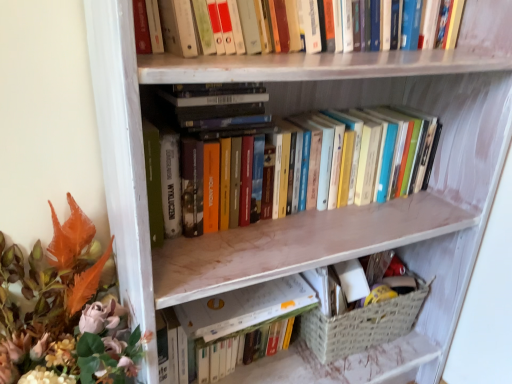
Question: Considering the relative sizes of hardcover books at upper center, placed as the first book when sorted from top to bottom, and matte orange leaves at left in the image provided, is hardcover books at upper center, placed as the first book when sorted from top to bottom, shorter than matte orange leaves at left?

Choices:
 (A) yes
 (B) no

Answer: (A)

Question: From a real-world perspective, is hardcover books at upper center, which is the second book from bottom to top, on top of matte orange leaves at left?

Choices:
 (A) yes
 (B) no

Answer: (A)

Question: Can you confirm if hardcover books at upper center, which is the second book from bottom to top, is taller than matte orange leaves at left?

Choices:
 (A) yes
 (B) no

Answer: (B)

Question: Is hardcover books at upper center, which is the second book from bottom to top, closer to the viewer compared to matte orange leaves at left?

Choices:
 (A) yes
 (B) no

Answer: (B)

Question: Can you confirm if hardcover books at upper center, placed as the first book when sorted from top to bottom, is smaller than matte orange leaves at left?

Choices:
 (A) no
 (B) yes

Answer: (B)

Question: Is hardcover books at upper center, which is the second book from bottom to top, aimed at matte orange leaves at left?

Choices:
 (A) no
 (B) yes

Answer: (A)

Question: Is hardcover books at upper center, which is the second book from bottom to top, not inside woven beige basket at lower right?

Choices:
 (A) yes
 (B) no

Answer: (A)

Question: From a real-world perspective, is hardcover books at upper center, placed as the first book when sorted from top to bottom, physically above woven beige basket at lower right?

Choices:
 (A) no
 (B) yes

Answer: (B)

Question: Can you confirm if hardcover books at upper center, which is the second book from bottom to top, is thinner than woven beige basket at lower right?

Choices:
 (A) yes
 (B) no

Answer: (A)

Question: From a real-world perspective, is hardcover books at upper center, placed as the first book when sorted from top to bottom, located beneath woven beige basket at lower right?

Choices:
 (A) yes
 (B) no

Answer: (B)

Question: Is hardcover books at upper center, placed as the first book when sorted from top to bottom, turned away from woven beige basket at lower right?

Choices:
 (A) no
 (B) yes

Answer: (A)

Question: Is hardcover books at upper center, which is the second book from bottom to top, closer to the viewer compared to woven beige basket at lower right?

Choices:
 (A) yes
 (B) no

Answer: (A)

Question: Is woven beige basket at lower right further to camera compared to matte orange leaves at left?

Choices:
 (A) no
 (B) yes

Answer: (B)